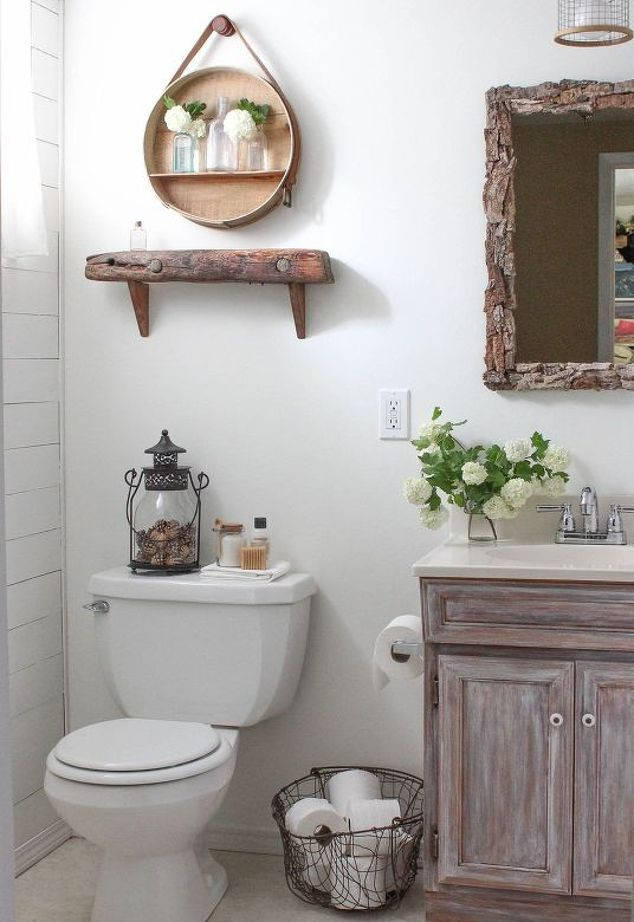
Find the location of a particular element. Image resolution: width=634 pixels, height=922 pixels. mirror is located at coordinates click(x=550, y=289).